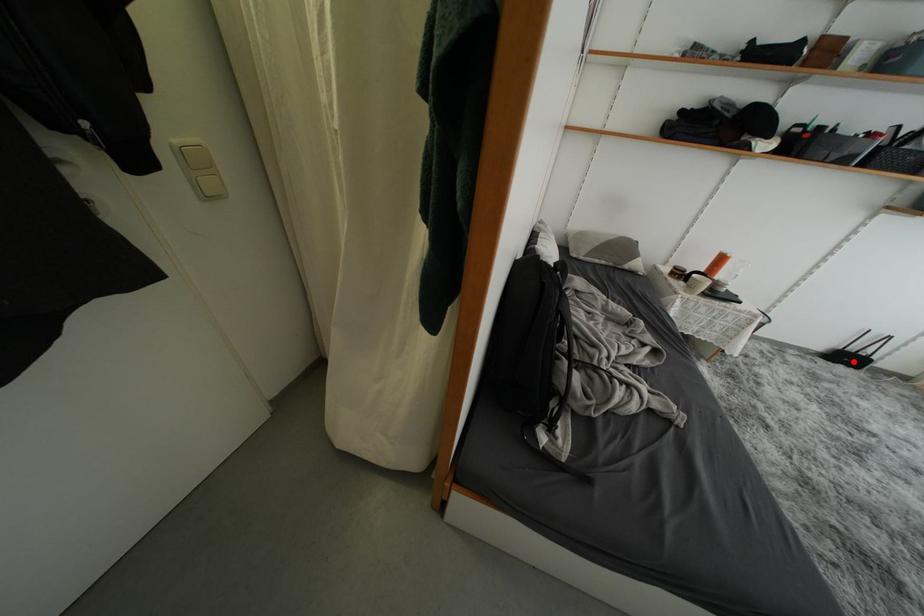
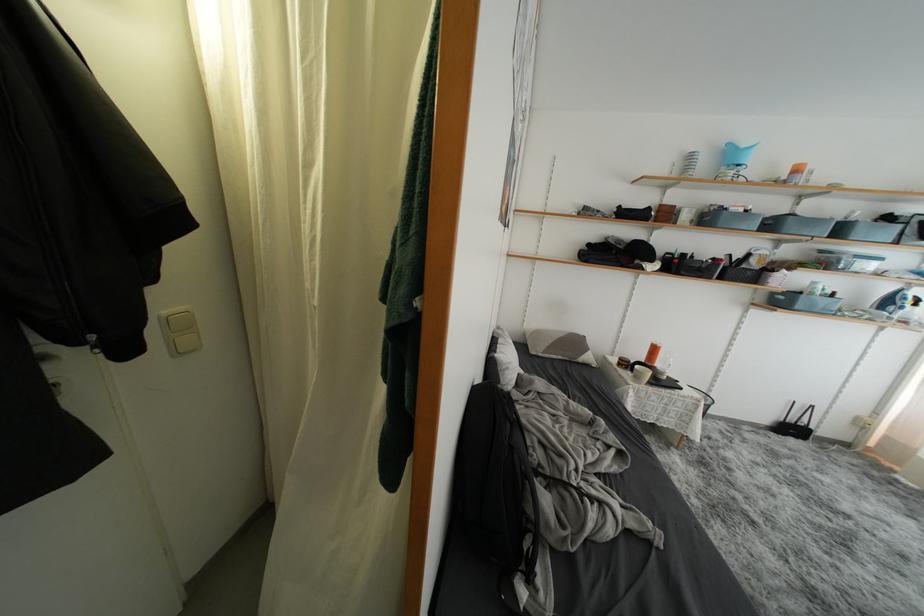
Question: I am providing you with two images of the same scene from different viewpoints. A red point is shown in image1. For the corresponding object point in image2, is it positioned nearer or farther from the camera?

Choices:
 (A) Nearer
 (B) Farther

Answer: (A)